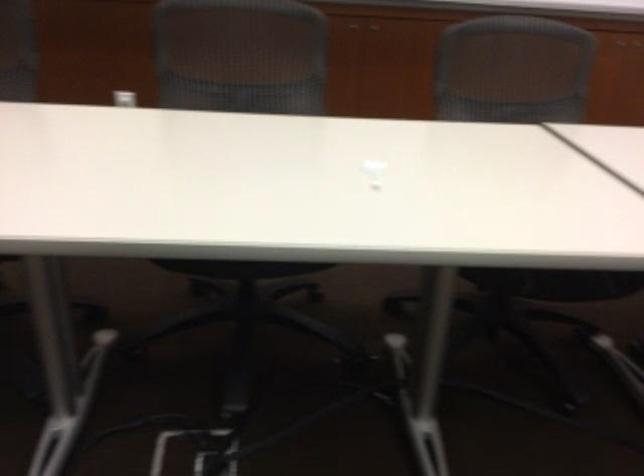
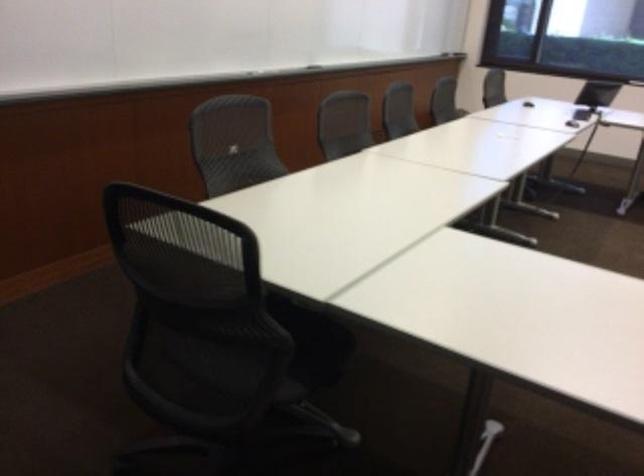
Question: I am providing you with two images of the same scene from different viewpoints. Please identify which objects are invisible in image2.

Choices:
 (A) yellow push button
 (B) chair sitting surface
 (C) white chair lever
 (D) black laptop computer

Answer: (C)